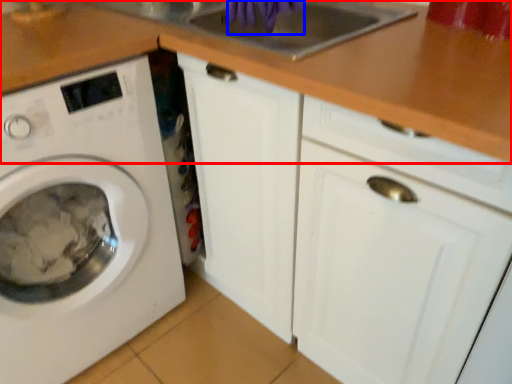
Question: Among these objects, which one is farthest to the camera, counter top (highlighted by a red box) or hand (highlighted by a blue box)?

Choices:
 (A) counter top
 (B) hand

Answer: (B)